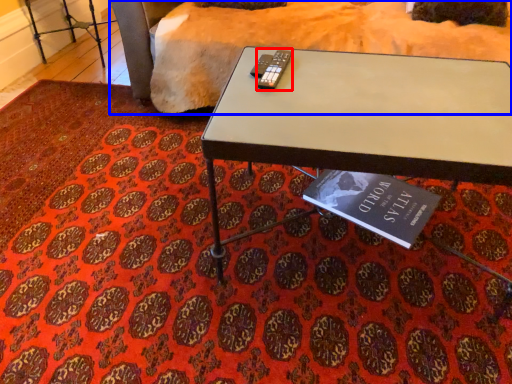
Question: Which of the following is the farthest to the observer, remote (highlighted by a red box) or bedding (highlighted by a blue box)?

Choices:
 (A) remote
 (B) bedding

Answer: (B)